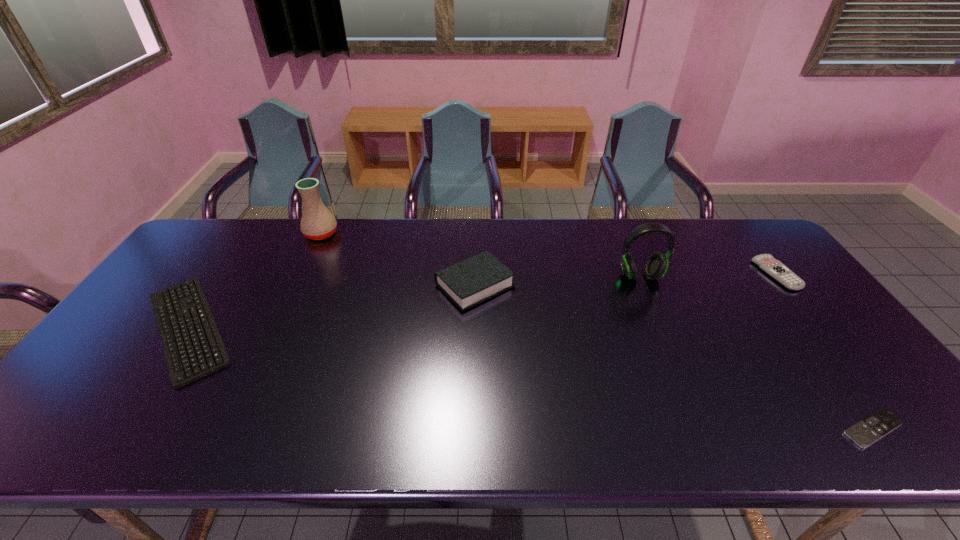
Identify the location of vacant space located 0.310m on the ear cups of the headset. This screenshot has height=540, width=960. (679, 370).

Identify the location of free location located 0.090m on the front of the Bible. (474, 337).

Identify the location of vacant space located on the front of the farther remote control. The image size is (960, 540). (817, 327).

Locate an element on the screen. This screenshot has height=540, width=960. vacant area located on the back of the leftmost object is located at coordinates (232, 262).

The width and height of the screenshot is (960, 540). I want to click on vacant space located on the back of the shorter remote control, so click(x=820, y=357).

Where is `pottery at the far edge`? The height and width of the screenshot is (540, 960). pottery at the far edge is located at coordinates (317, 223).

Locate an element on the screen. This screenshot has height=540, width=960. remote control that is at the far edge is located at coordinates (766, 262).

Locate an element on the screen. This screenshot has width=960, height=540. object at the near edge is located at coordinates (865, 432).

This screenshot has width=960, height=540. What are the coordinates of `object that is at the left edge` in the screenshot? It's located at (193, 347).

The image size is (960, 540). I want to click on object at the far right corner, so [766, 262].